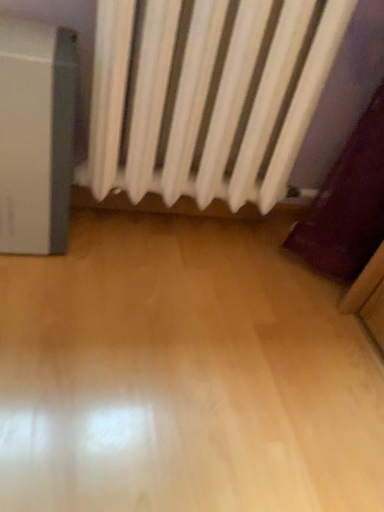
Where is `vacant space situated above satin silver air purifier at left (from a real-world perspective)`? vacant space situated above satin silver air purifier at left (from a real-world perspective) is located at coordinates (32, 29).